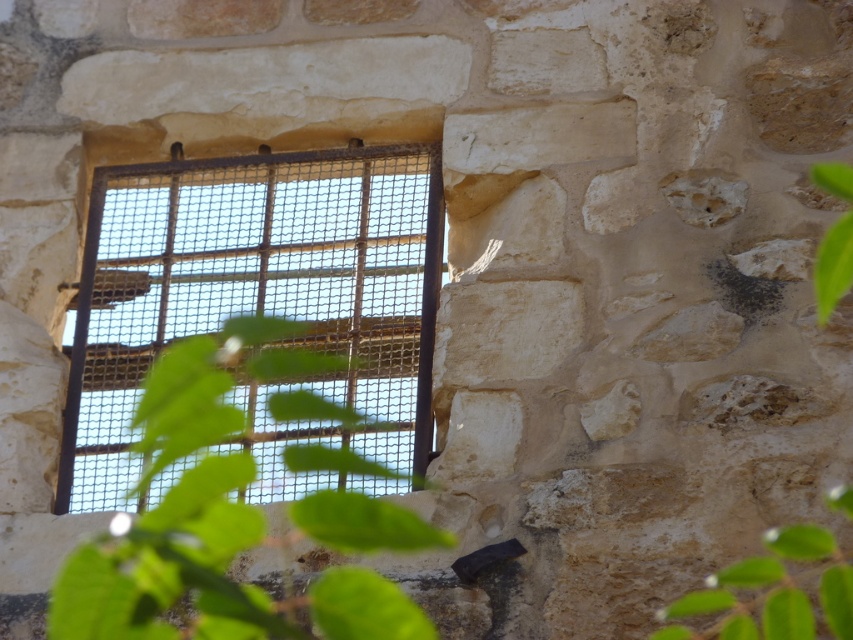
From the picture: You are a gardener who needs to water two green leafy plants. You have a watering can that can hold enough water for 6 meters of travel. The plants are the green leafy plant at center and the green leafy plant at lower right. If you start at the center plant, can you water both plants without needing to refill your watering can?

The green leafy plant at center and the green leafy plant at lower right are 7.02 meters apart from each other. Since the watering can can only hold enough water for 6 meters of travel, you would not have enough water to reach both plants without refilling.